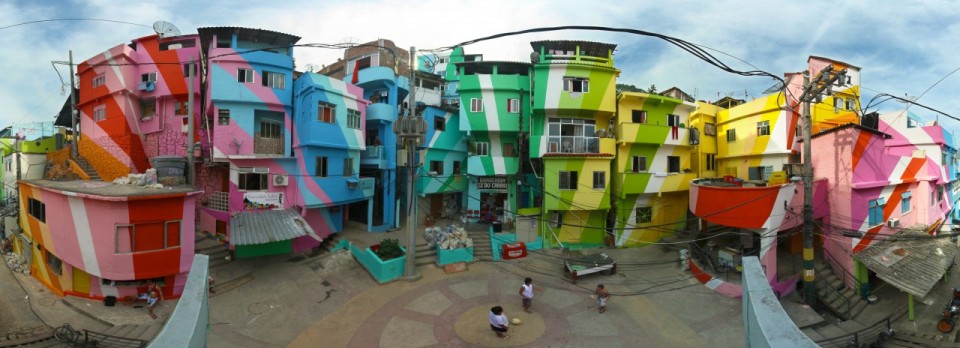
Identify the location of apartments. (337, 123).